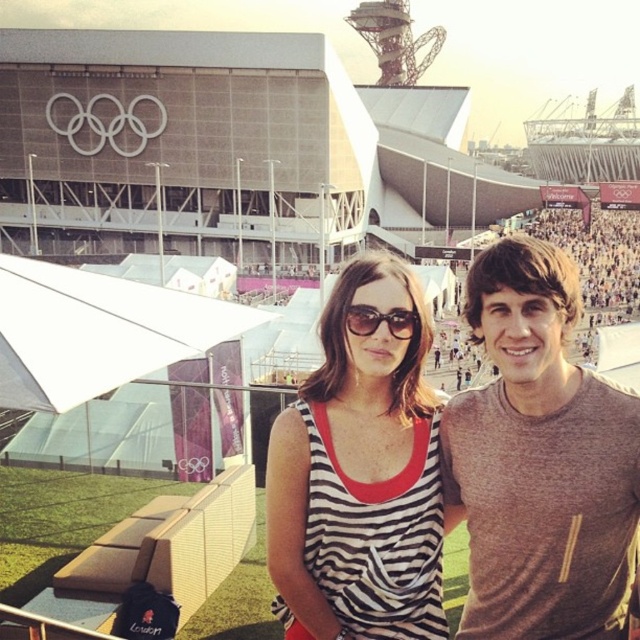
Question: In this image, where is striped fabric tank top at center located relative to sunglasses at center?

Choices:
 (A) below
 (B) above

Answer: (A)

Question: Does striped fabric tank top at center have a greater width compared to sunglasses at center?

Choices:
 (A) yes
 (B) no

Answer: (A)

Question: Estimate the real-world distances between objects in this image. Which object is closer to the sunglasses at center?

Choices:
 (A) striped fabric tank top at center
 (B) gray cotton t-shirt at center

Answer: (A)

Question: Among these objects, which one is farthest from the camera?

Choices:
 (A) sunglasses at center
 (B) striped fabric tank top at center

Answer: (A)

Question: Among these objects, which one is farthest from the camera?

Choices:
 (A) gray cotton t-shirt at center
 (B) striped fabric tank top at center
 (C) sunglasses at center

Answer: (C)

Question: Does gray cotton t-shirt at center have a lesser width compared to striped fabric tank top at center?

Choices:
 (A) no
 (B) yes

Answer: (B)